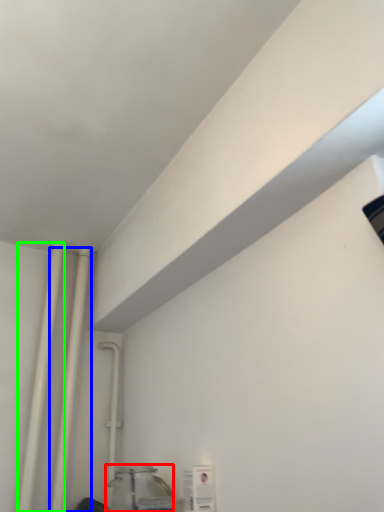
Question: Considering the real-world distances, which object is farthest from glass jar (highlighted by a red box)? pipe (highlighted by a blue box) or pipe (highlighted by a green box)?

Choices:
 (A) pipe
 (B) pipe

Answer: (B)